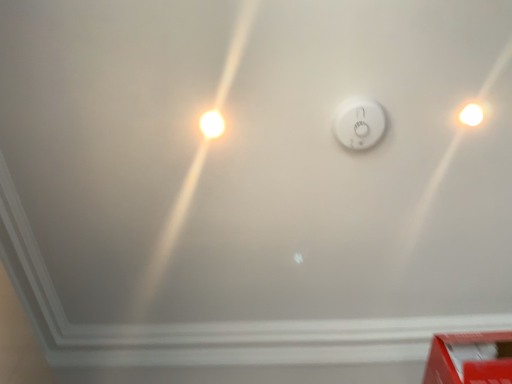
Question: Can you confirm if white plastic smoke detector at center is wider than white glossy light bulb at upper right, the 1th light bulb in the right-to-left sequence?

Choices:
 (A) yes
 (B) no

Answer: (A)

Question: Is white plastic smoke detector at center to the left of white glossy light bulb at upper right, the 1th light bulb in the right-to-left sequence, from the viewer's perspective?

Choices:
 (A) no
 (B) yes

Answer: (B)

Question: From a real-world perspective, is white plastic smoke detector at center on white glossy light bulb at upper right, the 1th light bulb in the right-to-left sequence?

Choices:
 (A) yes
 (B) no

Answer: (B)

Question: Does white plastic smoke detector at center turn towards white glossy light bulb at upper right, the 1th light bulb in the right-to-left sequence?

Choices:
 (A) yes
 (B) no

Answer: (A)

Question: Is white plastic smoke detector at center to the right of white glossy light bulb at upper right, the 1th light bulb in the right-to-left sequence, from the viewer's perspective?

Choices:
 (A) no
 (B) yes

Answer: (A)

Question: Is white glossy light bulb at upper right, the 1th light bulb in the right-to-left sequence, inside the boundaries of white glossy light bulb at upper left, the 1th light bulb from the left, or outside?

Choices:
 (A) outside
 (B) inside

Answer: (A)

Question: From a real-world perspective, is white glossy light bulb at upper right, the 1th light bulb in the right-to-left sequence, above or below white glossy light bulb at upper left, placed as the second light bulb when sorted from right to left?

Choices:
 (A) below
 (B) above

Answer: (B)

Question: Considering the positions of white glossy light bulb at upper right, the 1th light bulb in the right-to-left sequence, and white glossy light bulb at upper left, placed as the second light bulb when sorted from right to left, in the image, is white glossy light bulb at upper right, the 1th light bulb in the right-to-left sequence, wider or thinner than white glossy light bulb at upper left, placed as the second light bulb when sorted from right to left,?

Choices:
 (A) thin
 (B) wide

Answer: (B)

Question: Is point click(473, 104) positioned closer to the camera than point click(209, 119)?

Choices:
 (A) farther
 (B) closer

Answer: (B)

Question: From the image's perspective, relative to white plastic smoke detector at center, is red cardboard box at lower right above or below?

Choices:
 (A) below
 (B) above

Answer: (A)

Question: Relative to white plastic smoke detector at center, is red cardboard box at lower right in front or behind?

Choices:
 (A) front
 (B) behind

Answer: (A)

Question: From a real-world perspective, is red cardboard box at lower right positioned above or below white plastic smoke detector at center?

Choices:
 (A) above
 (B) below

Answer: (B)

Question: Considering the positions of point (502, 374) and point (349, 104), is point (502, 374) closer or farther from the camera than point (349, 104)?

Choices:
 (A) farther
 (B) closer

Answer: (B)

Question: Is white glossy light bulb at upper left, placed as the second light bulb when sorted from right to left, inside the boundaries of white glossy light bulb at upper right, marked as the second light bulb in a left-to-right arrangement, or outside?

Choices:
 (A) inside
 (B) outside

Answer: (B)

Question: Does point (212, 114) appear closer or farther from the camera than point (480, 110)?

Choices:
 (A) farther
 (B) closer

Answer: (A)